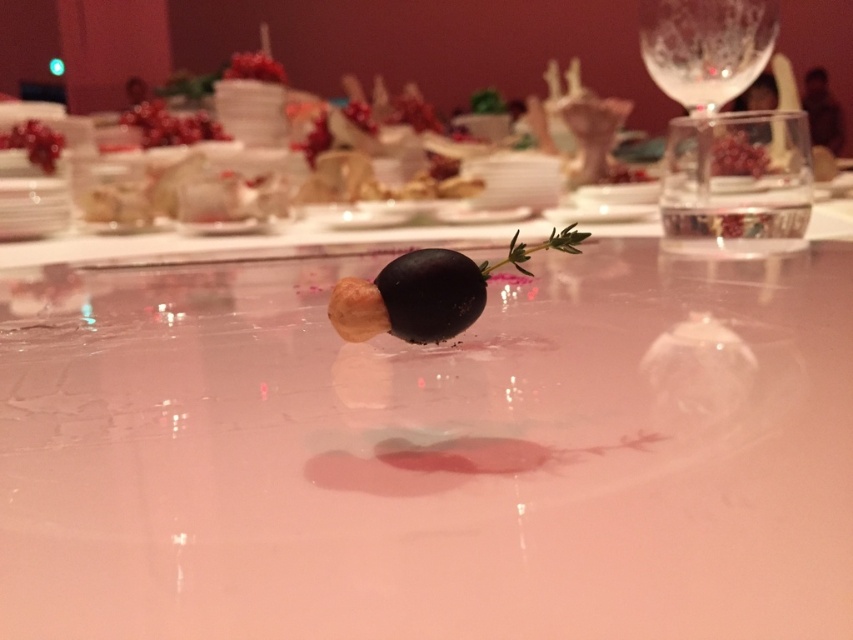
Is point (416, 298) less distant than point (709, 38)?

Yes, point (416, 298) is in front of point (709, 38).

Does point (352, 308) lie in front of point (712, 113)?

Yes.

Identify the location of shiny black olive at center. (427, 291).

Consider the image. Who is shorter, shiny red berries at upper center or pomegranate seeds at upper left?

pomegranate seeds at upper left

This screenshot has width=853, height=640. Describe the element at coordinates (170, 125) in the screenshot. I see `shiny red berries at upper center` at that location.

Locate an element on the screen. This screenshot has width=853, height=640. shiny red berries at upper center is located at coordinates (170, 125).

Is point (447, 304) behind point (148, 120)?

No, it is in front of (148, 120).

Between point (363, 323) and point (129, 122), which one is positioned in front?

Point (363, 323) is more forward.

Image resolution: width=853 pixels, height=640 pixels. Describe the element at coordinates (427, 291) in the screenshot. I see `shiny black olive at center` at that location.

Find the location of a particular element. This screenshot has height=640, width=853. shiny black olive at center is located at coordinates (427, 291).